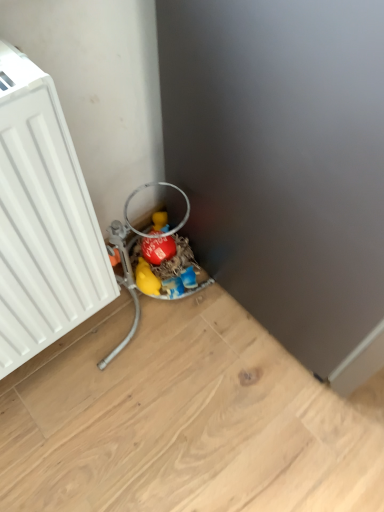
Measure the distance between white matte radiator at left and camera.

white matte radiator at left and camera are 20.67 inches apart.

Describe the element at coordinates (43, 220) in the screenshot. The height and width of the screenshot is (512, 384). I see `white matte radiator at left` at that location.

The image size is (384, 512). In order to click on white matte radiator at left in this screenshot , I will do `click(43, 220)`.

Image resolution: width=384 pixels, height=512 pixels. Find the location of `white matte radiator at left`. white matte radiator at left is located at coordinates (43, 220).